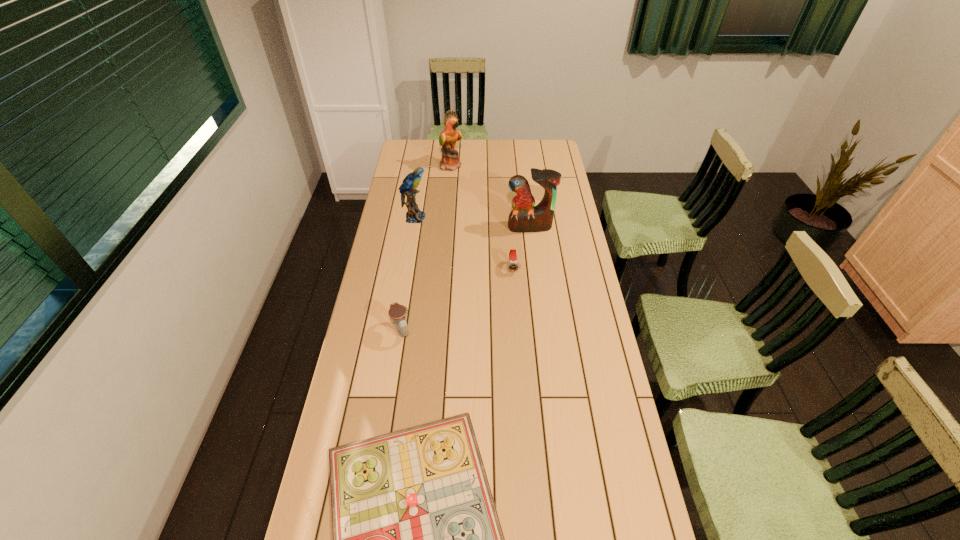
Image resolution: width=960 pixels, height=540 pixels. In order to click on free space located 0.360m on the face of the leftmost parrot in this screenshot , I will do `click(511, 218)`.

Where is `free space located on the front of the left watch`? The width and height of the screenshot is (960, 540). free space located on the front of the left watch is located at coordinates (387, 424).

This screenshot has width=960, height=540. I want to click on vacant space situated 0.320m on the face of the fourth farthest object, so click(x=518, y=343).

Identify the location of object that is at the far edge. (450, 161).

At what (x,y) coordinates should I click in order to perform the action: click on parrot that is positioned at the left edge. Please return your answer as a coordinate pair (x, y). Looking at the image, I should click on (408, 187).

You are a GUI agent. You are given a task and a screenshot of the screen. Output one action in this format:
    pyautogui.click(x=<x>, y=<y>)
    Task: Click on the watch located in the left edge section of the desktop
    This screenshot has width=960, height=540.
    Given the screenshot: What is the action you would take?
    pyautogui.click(x=397, y=312)

At what (x,y) coordinates should I click in order to perform the action: click on object at the right edge. Please return your answer as a coordinate pair (x, y). The image size is (960, 540). Looking at the image, I should click on (525, 217).

In order to click on free space at the far edge of the desktop in this screenshot , I will do `click(522, 144)`.

The image size is (960, 540). I want to click on free region at the left edge of the desktop, so click(407, 168).

This screenshot has width=960, height=540. Find the location of `vacant region at the right edge of the desktop`. vacant region at the right edge of the desktop is located at coordinates (589, 409).